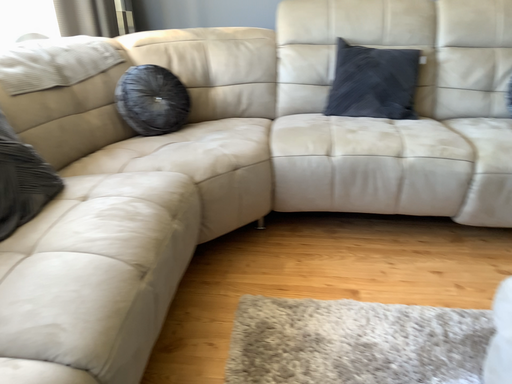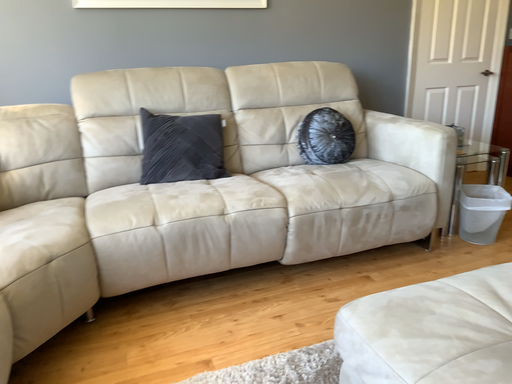
Question: Which way did the camera rotate in the video?

Choices:
 (A) rotated right
 (B) rotated left

Answer: (A)